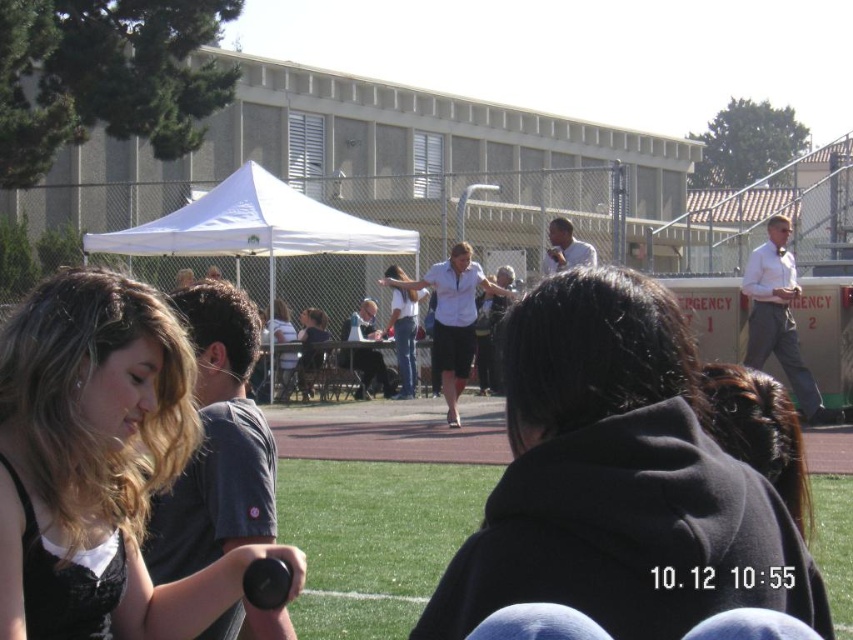
Question: Does green grass at center lie behind matte white shirt at center?

Choices:
 (A) no
 (B) yes

Answer: (A)

Question: Which object is positioned farthest from the white fabric canopy at center?

Choices:
 (A) black fabric hair at center
 (B) matte white shirt at center

Answer: (A)

Question: Which object is positioned farthest from the white fabric canopy at center?

Choices:
 (A) black fabric hair at center
 (B) matte white shirt at center
 (C) green grass at center

Answer: (A)

Question: Can you confirm if green grass at center is thinner than white fabric canopy at center?

Choices:
 (A) yes
 (B) no

Answer: (B)

Question: Which object is positioned closest to the black fabric hair at center?

Choices:
 (A) green grass at center
 (B) matte white shirt at center

Answer: (A)

Question: Where is black fabric hair at center located in relation to matte white shirt at center in the image?

Choices:
 (A) above
 (B) below

Answer: (B)